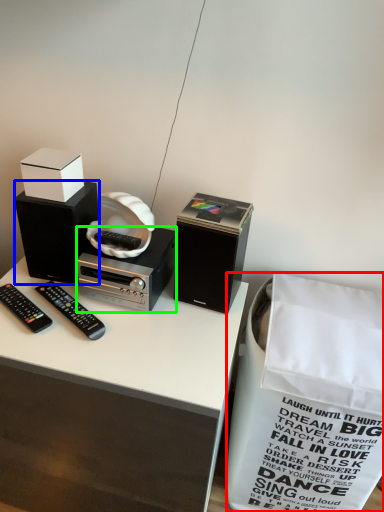
Question: Which is nearer to the shopping bag (highlighted by a red box)? speaker (highlighted by a blue box) or cassette (highlighted by a green box).

Choices:
 (A) speaker
 (B) cassette

Answer: (B)